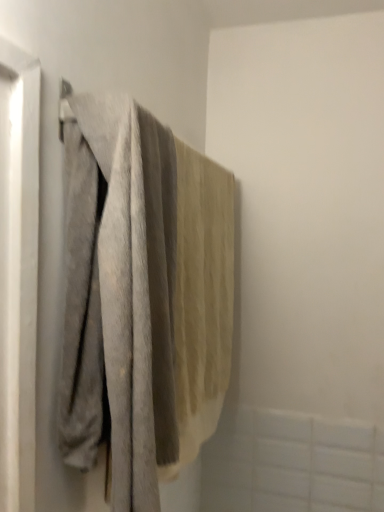
The height and width of the screenshot is (512, 384). Find the location of `gray textured towel at left`. gray textured towel at left is located at coordinates (142, 295).

The width and height of the screenshot is (384, 512). What do you see at coordinates (142, 295) in the screenshot?
I see `gray textured towel at left` at bounding box center [142, 295].

Where is `gray textured towel at left`? gray textured towel at left is located at coordinates (142, 295).